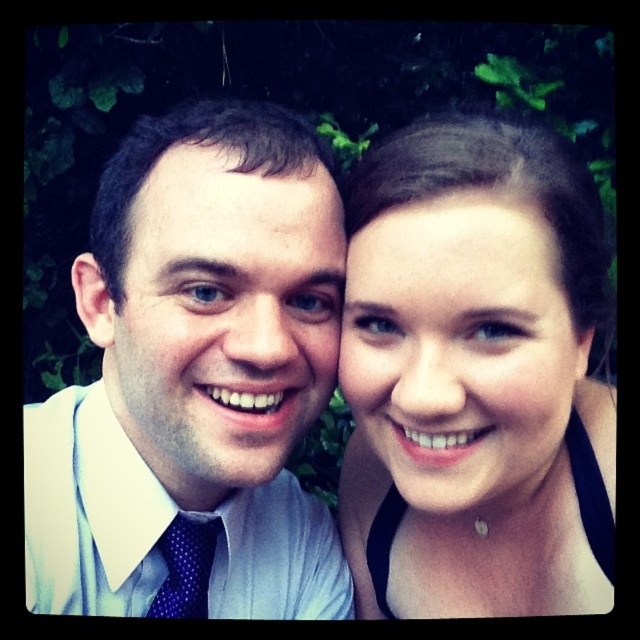
Does matte skin at center have a smaller size compared to blue dotted tie at lower left?

No, matte skin at center is not smaller than blue dotted tie at lower left.

Between matte skin at center and blue dotted tie at lower left, which one is positioned lower?

blue dotted tie at lower left is below.

Locate an element on the screen. matte skin at center is located at coordinates (476, 378).